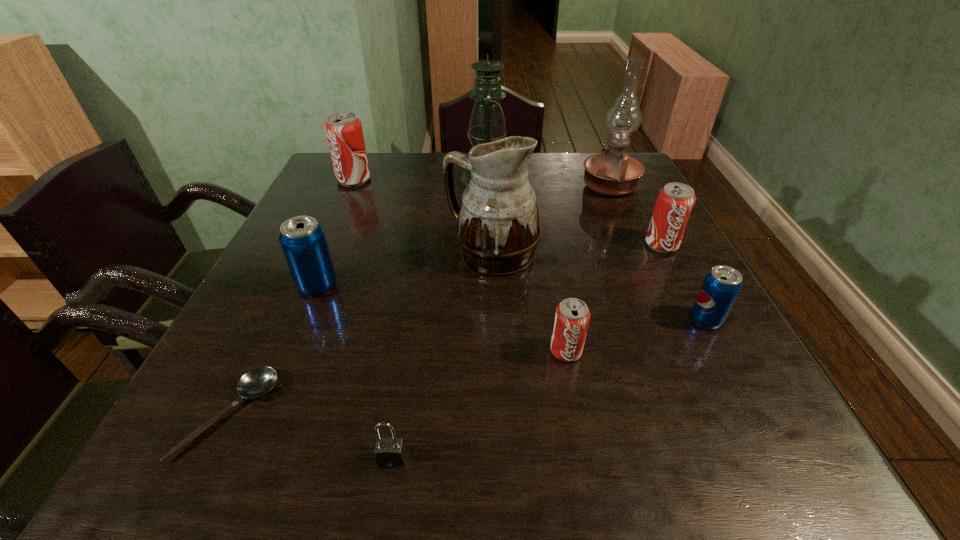
Locate an element on the screen. The image size is (960, 540). padlock at the near edge is located at coordinates (389, 452).

I want to click on ladle that is positioned at the near edge, so click(x=258, y=381).

Locate an element on the screen. The image size is (960, 540). ladle located at the left edge is located at coordinates (258, 381).

The height and width of the screenshot is (540, 960). What are the coordinates of `oil lamp that is at the right edge` in the screenshot? It's located at (612, 173).

Identify the location of object at the far left corner. The height and width of the screenshot is (540, 960). (344, 134).

Find the location of a particular element. The width and height of the screenshot is (960, 540). object positioned at the near left corner is located at coordinates (258, 381).

The height and width of the screenshot is (540, 960). I want to click on object present at the far right corner, so click(x=612, y=173).

Find the location of a particular element. The height and width of the screenshot is (540, 960). free point at the far edge is located at coordinates (404, 159).

This screenshot has width=960, height=540. Find the location of `blank space at the near edge of the desktop`. blank space at the near edge of the desktop is located at coordinates (633, 433).

Where is `vacant space at the left edge`? vacant space at the left edge is located at coordinates [223, 352].